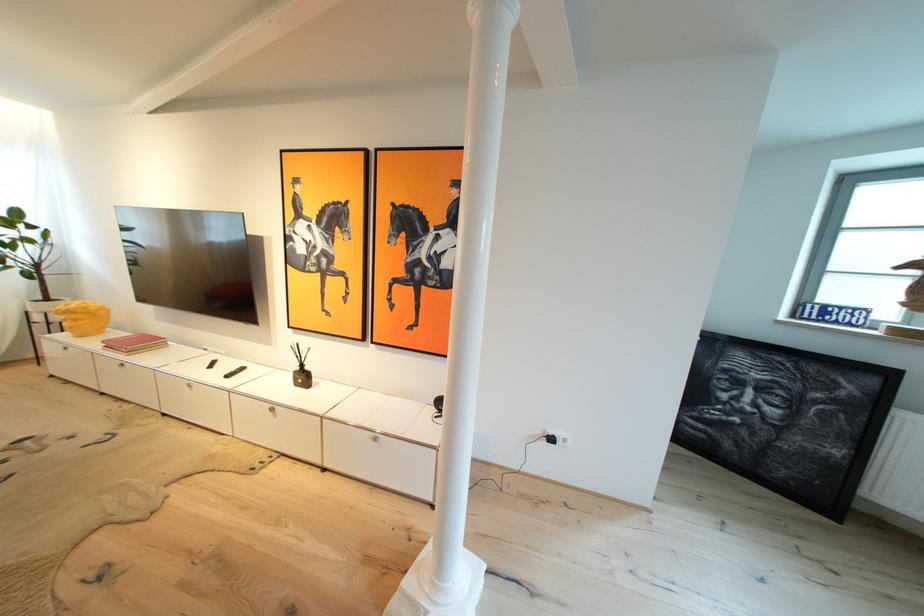
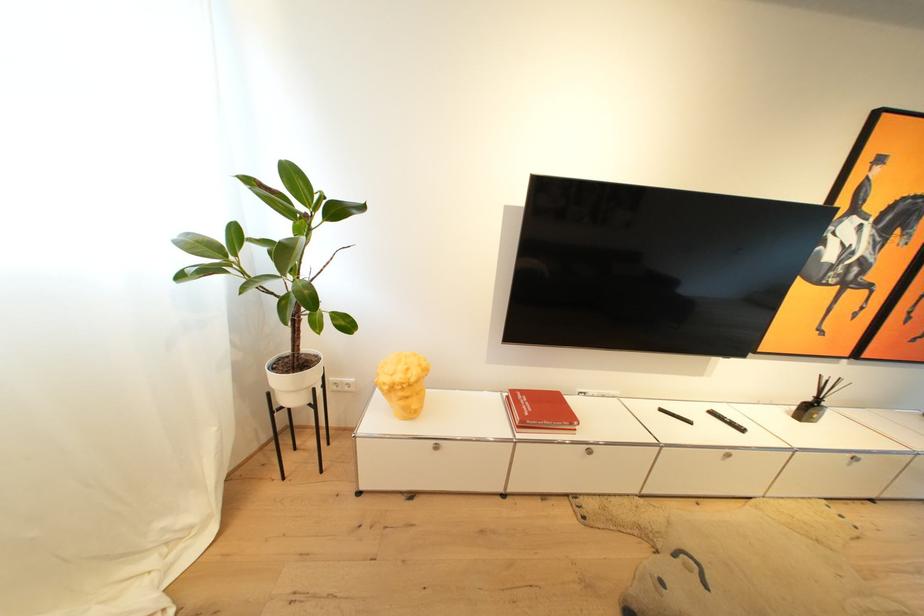
Question: In a continuous first-person perspective shot, in which direction is the camera moving?

Choices:
 (A) Left
 (B) Right
 (C) Forward
 (D) Backward

Answer: (A)